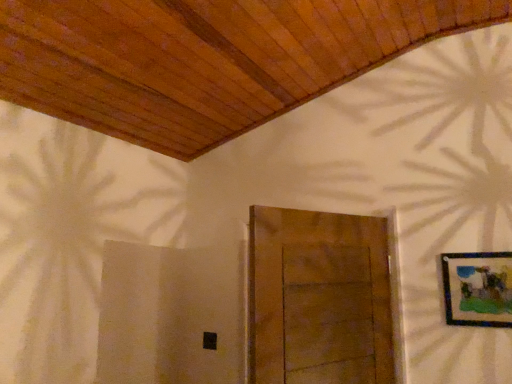
Question: Is wooden door at center to the left or to the right of wooden-framed artwork at upper right in the image?

Choices:
 (A) left
 (B) right

Answer: (A)

Question: From their relative heights in the image, would you say wooden door at center is taller or shorter than wooden-framed artwork at upper right?

Choices:
 (A) short
 (B) tall

Answer: (B)

Question: From the image's perspective, is wooden door at center positioned above or below wooden-framed artwork at upper right?

Choices:
 (A) above
 (B) below

Answer: (B)

Question: Is point (456, 314) closer or farther from the camera than point (368, 302)?

Choices:
 (A) closer
 (B) farther

Answer: (A)

Question: Looking at their shapes, would you say wooden-framed artwork at upper right is wider or thinner than wooden door at center?

Choices:
 (A) wide
 (B) thin

Answer: (B)

Question: Based on their positions, is wooden-framed artwork at upper right located to the left or right of wooden door at center?

Choices:
 (A) right
 (B) left

Answer: (A)

Question: From the image's perspective, is wooden-framed artwork at upper right above or below wooden door at center?

Choices:
 (A) above
 (B) below

Answer: (A)